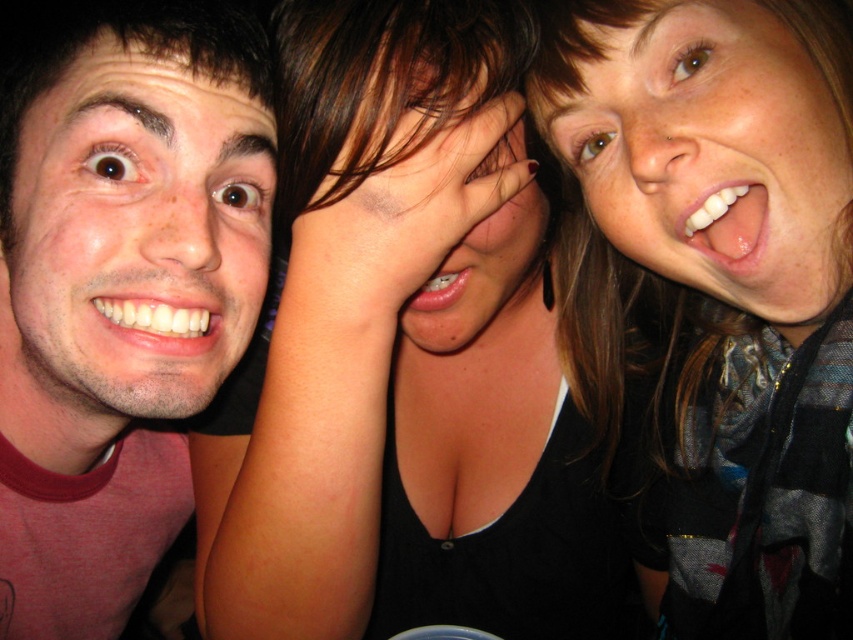
Is matte skin face at left to the right of pink glossy lips at center from the viewer's perspective?

Incorrect, matte skin face at left is not on the right side of pink glossy lips at center.

Between matte skin face at left and pink glossy lips at center, which one is positioned lower?

Positioned lower is pink glossy lips at center.

I want to click on matte skin face at left, so click(x=134, y=236).

Identify the location of matte skin face at left. This screenshot has width=853, height=640. (134, 236).

Is point (705, 198) positioned behind point (209, 337)?

No, (705, 198) is in front of (209, 337).

Between white glossy teeth at upper right and white glossy teeth at left, which one has more height?

white glossy teeth at upper right is taller.

The image size is (853, 640). What are the coordinates of `white glossy teeth at upper right` in the screenshot? It's located at (728, 221).

Locate an element on the screen. The image size is (853, 640). white glossy teeth at upper right is located at coordinates (728, 221).

Can you confirm if matte skin at center is thinner than pink glossy lips at center?

In fact, matte skin at center might be wider than pink glossy lips at center.

Can you confirm if matte skin at center is smaller than pink glossy lips at center?

No, matte skin at center is not smaller than pink glossy lips at center.

Locate an element on the screen. matte skin at center is located at coordinates (415, 166).